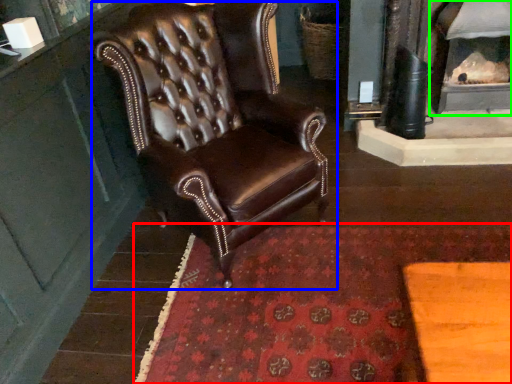
Question: Estimate the real-world distances between objects in this image. Which object is closer to mat (highlighted by a red box), chair (highlighted by a blue box) or fireplace (highlighted by a green box)?

Choices:
 (A) chair
 (B) fireplace

Answer: (A)